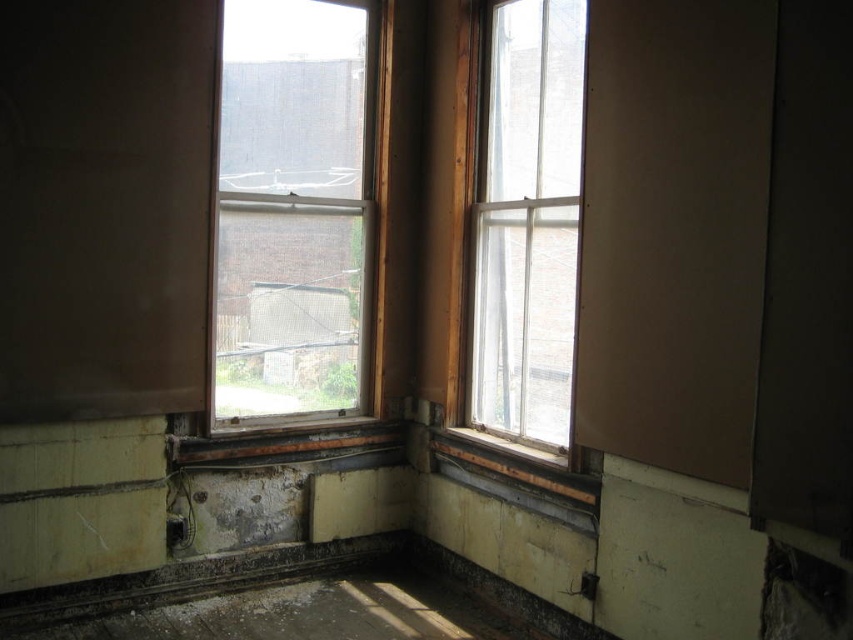
Is clear glass window at center wider than clear glass window at upper right?

Indeed, clear glass window at center has a greater width compared to clear glass window at upper right.

The height and width of the screenshot is (640, 853). I want to click on clear glass window at center, so pos(292,211).

What do you see at coordinates (292, 211) in the screenshot?
I see `clear glass window at center` at bounding box center [292, 211].

Locate an element on the screen. Image resolution: width=853 pixels, height=640 pixels. clear glass window at center is located at coordinates (292, 211).